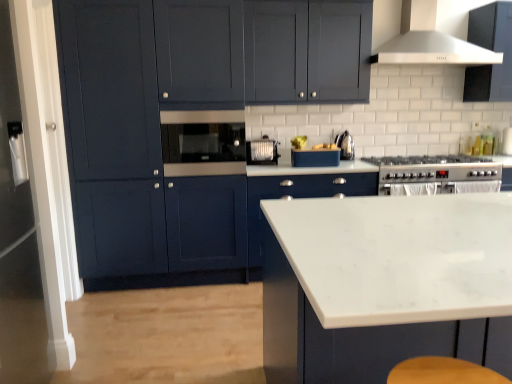
Question: In the image, is white matte range hood at upper center on the left side or the right side of white plastic toaster at center, the 2th appliance positioned from the right?

Choices:
 (A) left
 (B) right

Answer: (B)

Question: Is white matte range hood at upper center in front of or behind white plastic toaster at center, which is counted as the first appliance, starting from the left, in the image?

Choices:
 (A) behind
 (B) front

Answer: (B)

Question: Which object is positioned closest to the white plastic toaster at center, which is counted as the first appliance, starting from the left?

Choices:
 (A) white matte range hood at upper center
 (B) matte blue toaster at center, acting as the 1th appliance starting from the right
 (C) matte black microwave at center
 (D) white marble countertop at center, the 4th cabinetry from the back
 (E) silver metallic gas stove at center right

Answer: (B)

Question: Which of these objects is positioned farthest from the white matte range hood at upper center?

Choices:
 (A) matte black microwave at center
 (B) polished stainless steel kettle at right
 (C) silver metallic gas stove at center right
 (D) white glossy cabinet at center, the first cabinetry from the back
 (E) white plastic toaster at center, the 2th appliance positioned from the right

Answer: (A)